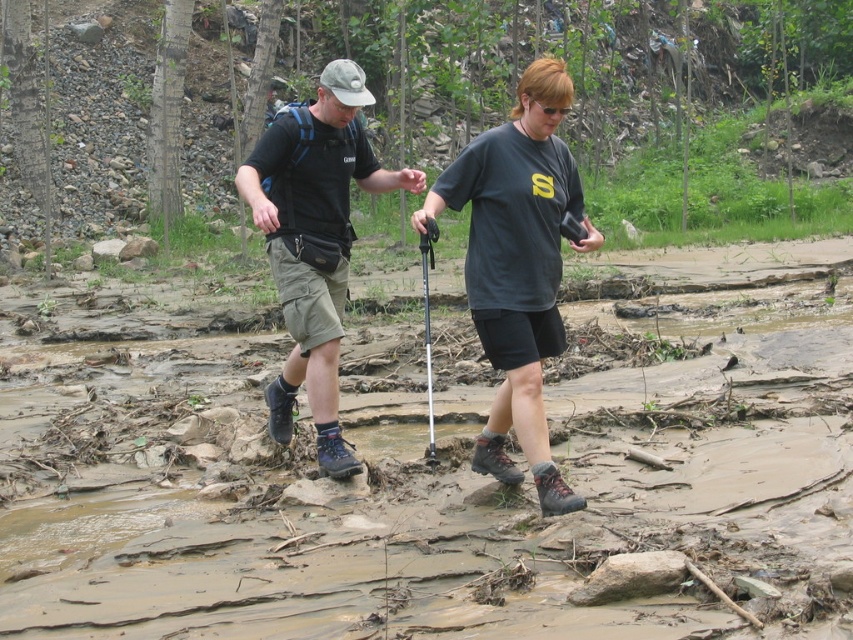
Describe the element at coordinates (518, 266) in the screenshot. This screenshot has width=853, height=640. I see `matte black t-shirt at center` at that location.

I want to click on matte black t-shirt at center, so click(x=518, y=266).